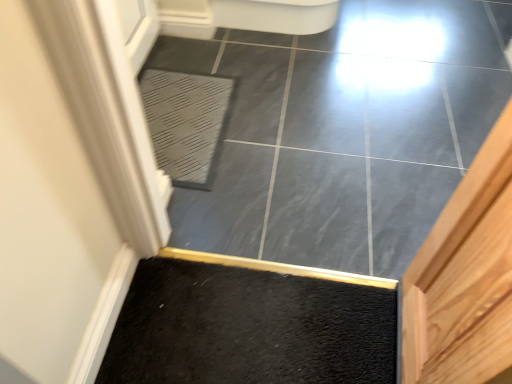
In order to click on gray textured bath mat at center in this screenshot , I will do `click(187, 123)`.

Describe the element at coordinates (187, 123) in the screenshot. I see `gray textured bath mat at center` at that location.

Where is `slate gray tile at center`? This screenshot has width=512, height=384. slate gray tile at center is located at coordinates (345, 132).

Image resolution: width=512 pixels, height=384 pixels. Describe the element at coordinates (345, 132) in the screenshot. I see `slate gray tile at center` at that location.

The image size is (512, 384). I want to click on gray textured bath mat at center, so click(x=187, y=123).

Can you confirm if slate gray tile at center is positioned to the left of gray textured bath mat at center?

Incorrect, slate gray tile at center is not on the left side of gray textured bath mat at center.

Consider the image. Between slate gray tile at center and gray textured bath mat at center, which one is positioned behind?

gray textured bath mat at center is more distant.

Does point (436, 139) lie behind point (219, 145)?

Yes.

From the image's perspective, is slate gray tile at center above gray textured bath mat at center?

Indeed, from the image's perspective, slate gray tile at center is shown above gray textured bath mat at center.

From a real-world perspective, is slate gray tile at center positioned under gray textured bath mat at center based on gravity?

Yes.

Considering the relative sizes of slate gray tile at center and gray textured bath mat at center in the image provided, is slate gray tile at center thinner than gray textured bath mat at center?

In fact, slate gray tile at center might be wider than gray textured bath mat at center.

Is slate gray tile at center taller or shorter than gray textured bath mat at center?

Considering their sizes, slate gray tile at center has less height than gray textured bath mat at center.

Which of these two, slate gray tile at center or gray textured bath mat at center, is bigger?

slate gray tile at center.

Is slate gray tile at center not inside gray textured bath mat at center?

Yes.

Does slate gray tile at center touch gray textured bath mat at center?

No.

Could you tell me if slate gray tile at center is turned towards gray textured bath mat at center?

No, slate gray tile at center does not turn towards gray textured bath mat at center.

How different are the orientations of slate gray tile at center and gray textured bath mat at center in degrees?

The facing directions of slate gray tile at center and gray textured bath mat at center are 90.9 degrees apart.

Measure the distance between slate gray tile at center and gray textured bath mat at center.

slate gray tile at center and gray textured bath mat at center are 37.87 centimeters apart from each other.

You are a GUI agent. You are given a task and a screenshot of the screen. Output one action in this format:
    pyautogui.click(x=<x>, y=<y>)
    Task: Click on the bath mat behind the slate gray tile at center
    
    Given the screenshot: What is the action you would take?
    pyautogui.click(x=187, y=123)

Considering the relative positions of gray textured bath mat at center and slate gray tile at center in the image provided, is gray textured bath mat at center to the left of slate gray tile at center from the viewer's perspective?

Yes.

Between gray textured bath mat at center and slate gray tile at center, which one is positioned in front?

slate gray tile at center is more forward.

Is point (210, 176) positioned before point (262, 166)?

That is True.

From the image's perspective, which is below, gray textured bath mat at center or slate gray tile at center?

From the image's view, gray textured bath mat at center is below.

From a real-world perspective, which object stands above the other?

gray textured bath mat at center, from a real-world perspective.

Is gray textured bath mat at center wider than slate gray tile at center?

In fact, gray textured bath mat at center might be narrower than slate gray tile at center.

Is gray textured bath mat at center shorter than slate gray tile at center?

Incorrect, the height of gray textured bath mat at center does not fall short of that of slate gray tile at center.

Which of these two, gray textured bath mat at center or slate gray tile at center, is smaller?

Answer: gray textured bath mat at center.

Is gray textured bath mat at center inside or outside of slate gray tile at center?

gray textured bath mat at center is enclosed within slate gray tile at center.

Are gray textured bath mat at center and slate gray tile at center beside each other?

They are not placed beside each other.

Is gray textured bath mat at center oriented towards slate gray tile at center?

Yes, gray textured bath mat at center is turned towards slate gray tile at center.

This screenshot has width=512, height=384. What are the coordinates of `ceramic tile that appears above the gray textured bath mat at center (from the image's perspective)` in the screenshot? It's located at (345, 132).

Locate an element on the screen. This screenshot has width=512, height=384. bath mat lying below the slate gray tile at center (from the image's perspective) is located at coordinates point(187,123).

Where is `bath mat located on the left of slate gray tile at center`? The width and height of the screenshot is (512, 384). bath mat located on the left of slate gray tile at center is located at coordinates (187, 123).